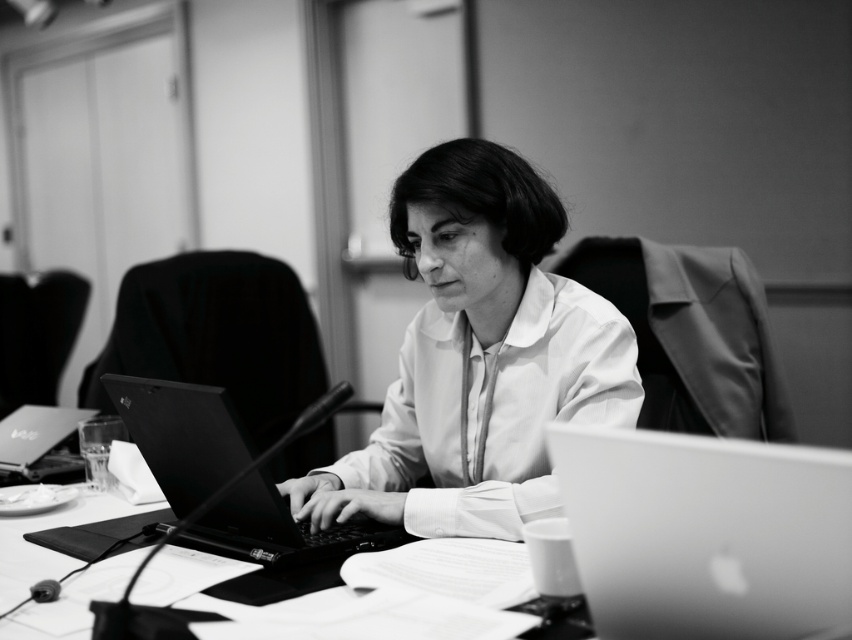
Question: Estimate the real-world distances between objects in this image. Which object is farther from the sleek silver laptop at center?

Choices:
 (A) matte black laptop at left
 (B) black matte laptop at center

Answer: (A)

Question: Does white smooth shirt at center have a greater width compared to black matte laptop at center?

Choices:
 (A) no
 (B) yes

Answer: (B)

Question: Can you confirm if sleek silver laptop at center is smaller than black matte laptop at center?

Choices:
 (A) yes
 (B) no

Answer: (A)

Question: Which object is the closest to the sleek silver laptop at center?

Choices:
 (A) matte black laptop at left
 (B) white smooth shirt at center

Answer: (B)

Question: Is black matte laptop at center positioned at the back of matte black laptop at left?

Choices:
 (A) yes
 (B) no

Answer: (B)

Question: Which point is farther to the camera?

Choices:
 (A) (245, 499)
 (B) (75, 460)

Answer: (B)